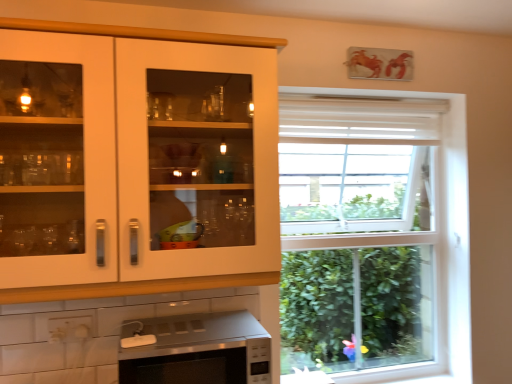
Question: Is satin silver microwave at lower center spatially inside white glossy cabinet at upper left, or outside of it?

Choices:
 (A) inside
 (B) outside

Answer: (B)

Question: Is point (251, 319) positioned closer to the camera than point (170, 195)?

Choices:
 (A) farther
 (B) closer

Answer: (B)

Question: From the image's perspective, is satin silver microwave at lower center located above or below white glossy cabinet at upper left?

Choices:
 (A) below
 (B) above

Answer: (A)

Question: Is white glossy cabinet at upper left taller or shorter than satin silver microwave at lower center?

Choices:
 (A) short
 (B) tall

Answer: (B)

Question: Visually, is white glossy cabinet at upper left positioned to the left or to the right of satin silver microwave at lower center?

Choices:
 (A) left
 (B) right

Answer: (A)

Question: Is point (97, 54) positioned closer to the camera than point (219, 334)?

Choices:
 (A) farther
 (B) closer

Answer: (B)

Question: Choose the correct answer: Is white glossy cabinet at upper left inside satin silver microwave at lower center or outside it?

Choices:
 (A) inside
 (B) outside

Answer: (B)